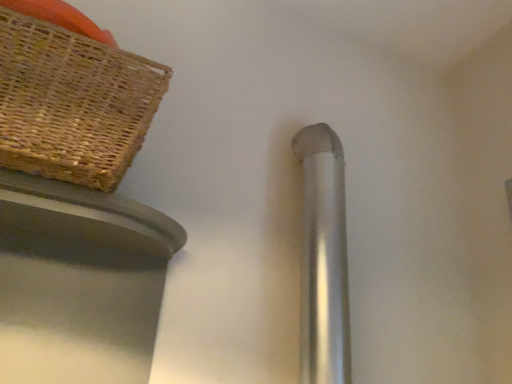
Question: Can you confirm if silver metallic door handle at center is shorter than woven brown picnic basket at upper left?

Choices:
 (A) no
 (B) yes

Answer: (A)

Question: Is silver metallic door handle at center to the left of woven brown picnic basket at upper left from the viewer's perspective?

Choices:
 (A) yes
 (B) no

Answer: (B)

Question: Can you confirm if silver metallic door handle at center is taller than woven brown picnic basket at upper left?

Choices:
 (A) yes
 (B) no

Answer: (A)

Question: Is silver metallic door handle at center not near woven brown picnic basket at upper left?

Choices:
 (A) no
 (B) yes

Answer: (A)

Question: Does silver metallic door handle at center have a larger size compared to woven brown picnic basket at upper left?

Choices:
 (A) yes
 (B) no

Answer: (B)

Question: Is silver metallic door handle at center oriented towards woven brown picnic basket at upper left?

Choices:
 (A) no
 (B) yes

Answer: (A)

Question: Does woven brown picnic basket at upper left contain silver metallic door handle at center?

Choices:
 (A) yes
 (B) no

Answer: (B)

Question: From a real-world perspective, is woven brown picnic basket at upper left under silver metallic door handle at center?

Choices:
 (A) yes
 (B) no

Answer: (B)

Question: Is woven brown picnic basket at upper left smaller than silver metallic door handle at center?

Choices:
 (A) no
 (B) yes

Answer: (A)

Question: Considering the relative positions of woven brown picnic basket at upper left and silver metallic door handle at center in the image provided, is woven brown picnic basket at upper left to the right of silver metallic door handle at center from the viewer's perspective?

Choices:
 (A) no
 (B) yes

Answer: (A)

Question: Is woven brown picnic basket at upper left thinner than silver metallic door handle at center?

Choices:
 (A) yes
 (B) no

Answer: (B)

Question: Can you confirm if woven brown picnic basket at upper left is positioned to the left of silver metallic door handle at center?

Choices:
 (A) no
 (B) yes

Answer: (B)

Question: In terms of size, does woven brown picnic basket at upper left appear bigger or smaller than silver metallic door handle at center?

Choices:
 (A) big
 (B) small

Answer: (A)